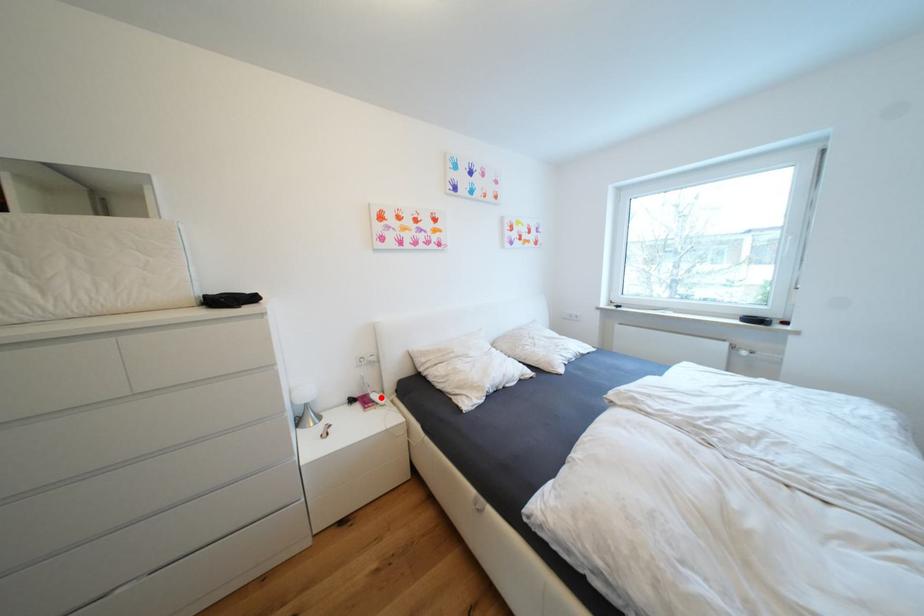
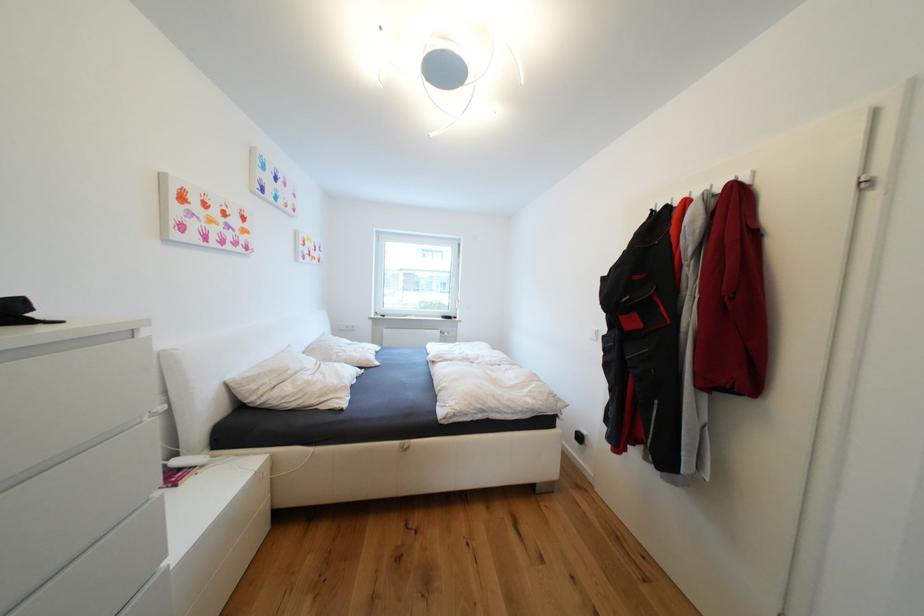
The point at the highlighted location is marked in the first image. Where is the corresponding point in the second image?

(184, 464)